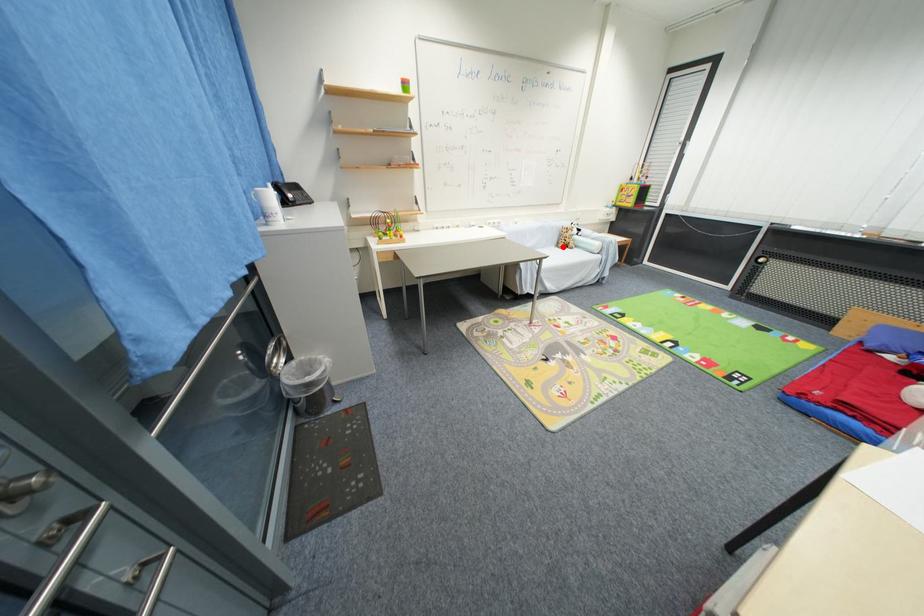
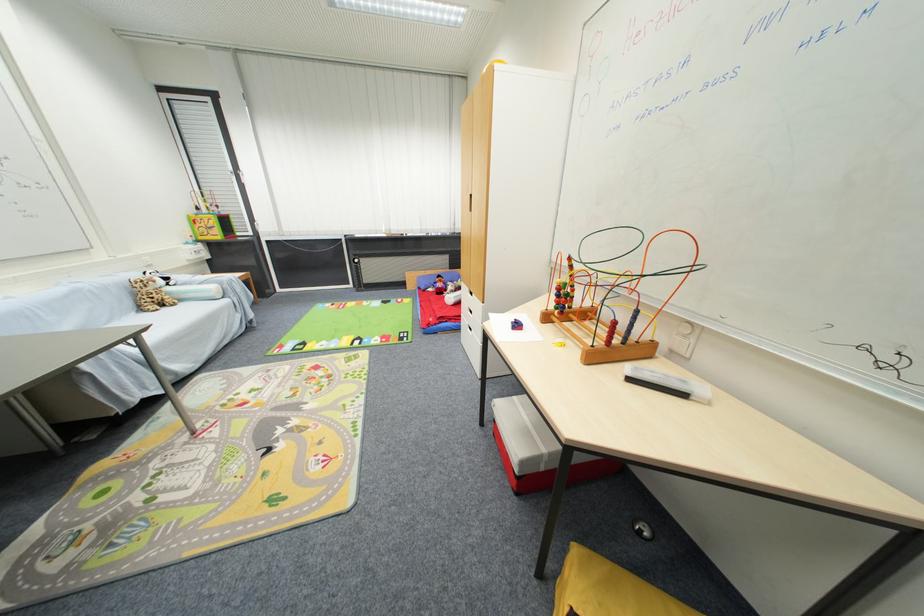
Where in the second image is the point corresponding to the highlighted location from the first image?

(146, 310)